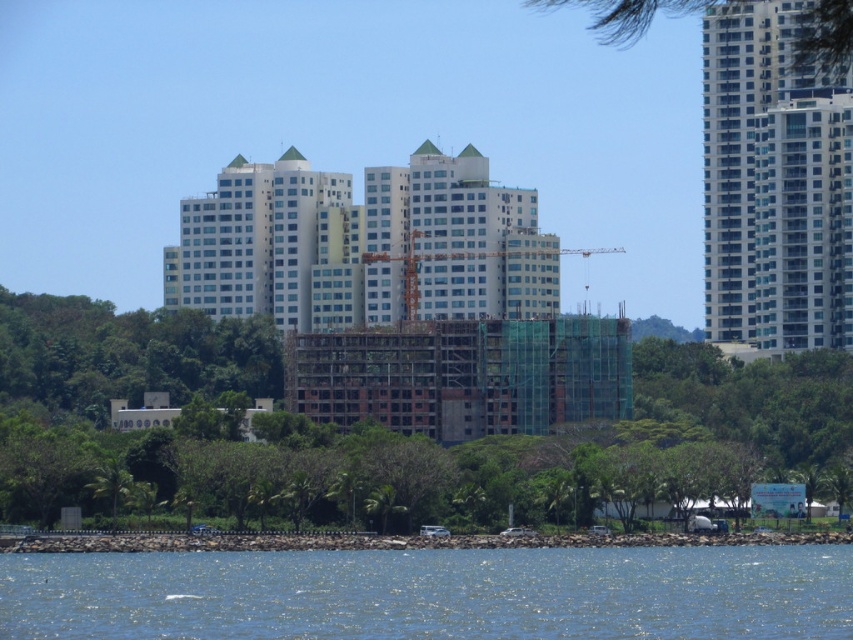
Who is more distant from viewer, (233,493) or (618,252)?

Point (618,252)

Between green leafy tree at center and orange metallic crane at center, which one appears on the right side from the viewer's perspective?

orange metallic crane at center is more to the right.

Is point (292, 509) farther from viewer compared to point (409, 310)?

No, it is not.

Where is `green leafy tree at center`? green leafy tree at center is located at coordinates (387, 429).

From the picture: Who is taller, blue liquid water at lower center or white smooth building at center?

Standing taller between the two is white smooth building at center.

Does point (538, 566) come closer to viewer compared to point (347, 234)?

Yes, point (538, 566) is closer to viewer.

Who is more forward, (219,552) or (318,204)?

Point (219,552) is more forward.

Image resolution: width=853 pixels, height=640 pixels. In order to click on blue liquid water at lower center in this screenshot , I will do `click(433, 593)`.

Does green leafy tree at center have a lesser width compared to green leafy tree at upper right?

No.

Is green leafy tree at center further to camera compared to green leafy tree at upper right?

Yes, green leafy tree at center is further from the viewer.

Does point (650, 419) lie in front of point (650, 12)?

No, it is not.

You are a GUI agent. You are given a task and a screenshot of the screen. Output one action in this format:
    pyautogui.click(x=<x>, y=<y>)
    Task: Click on the green leafy tree at center
    The width and height of the screenshot is (853, 640).
    Given the screenshot: What is the action you would take?
    pyautogui.click(x=387, y=429)